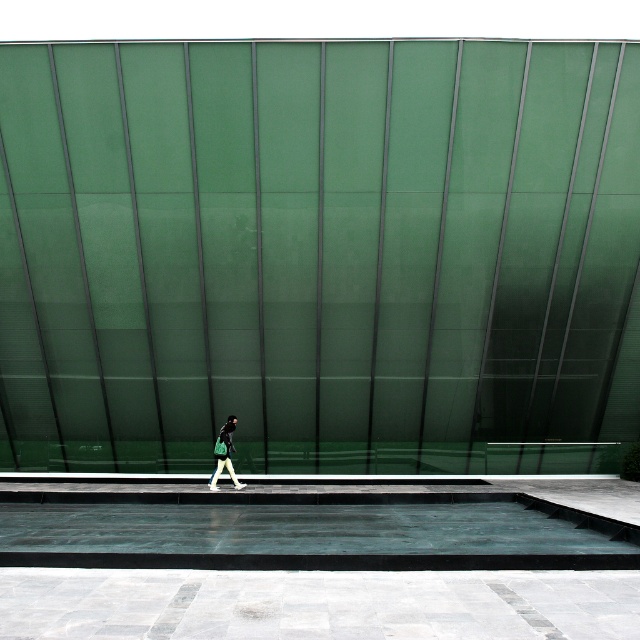
Question: Can you confirm if smooth concrete pool at center is positioned below matte black jacket at center?

Choices:
 (A) no
 (B) yes

Answer: (B)

Question: Which of the following is the farthest from the observer?

Choices:
 (A) matte black jacket at center
 (B) smooth concrete pool at center

Answer: (A)

Question: Is smooth concrete pool at center closer to the viewer compared to matte black jacket at center?

Choices:
 (A) yes
 (B) no

Answer: (A)

Question: Where is smooth concrete pool at center located in relation to matte black jacket at center in the image?

Choices:
 (A) right
 (B) left

Answer: (A)

Question: Which point is closer to the camera taking this photo?

Choices:
 (A) (428, 515)
 (B) (228, 460)

Answer: (A)

Question: Which point is farther from the camera taking this photo?

Choices:
 (A) (468, 502)
 (B) (234, 428)

Answer: (B)